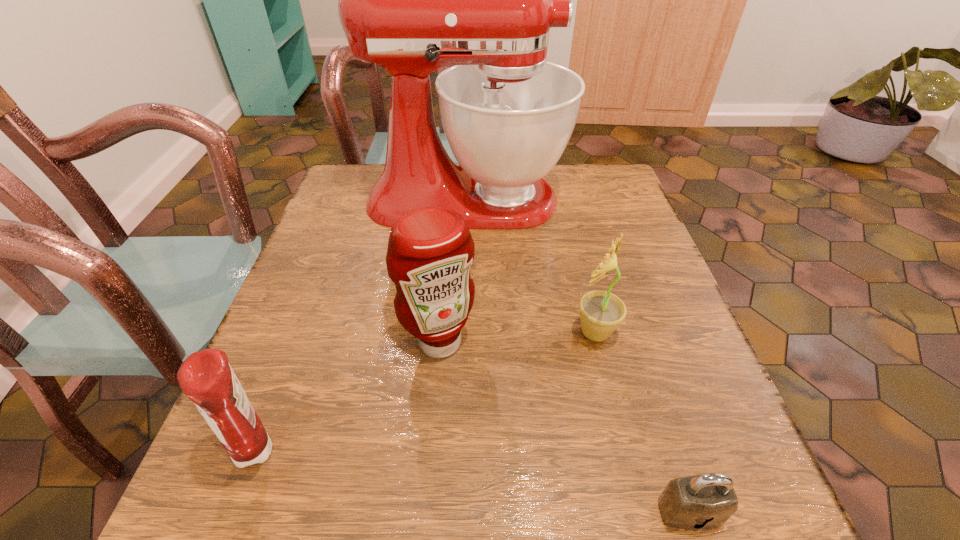
You are a GUI agent. You are given a task and a screenshot of the screen. Output one action in this format:
    pyautogui.click(x=<x>, y=<y>)
    Task: Click on the mixer
    This screenshot has height=540, width=960.
    Given the screenshot: What is the action you would take?
    pyautogui.click(x=412, y=0)

Where is `the tallest object`? the tallest object is located at coordinates (412, 0).

Where is `the right condiment`? Image resolution: width=960 pixels, height=540 pixels. the right condiment is located at coordinates (430, 250).

Where is `the taller condiment`? The image size is (960, 540). the taller condiment is located at coordinates (430, 250).

This screenshot has width=960, height=540. I want to click on sunflower, so click(601, 312).

Find the location of a particular element. The width and height of the screenshot is (960, 540). the shorter condiment is located at coordinates (206, 378).

Where is `the left condiment`? This screenshot has height=540, width=960. the left condiment is located at coordinates (206, 378).

At what (x,y) coordinates should I click in order to perform the action: click on the shortest object. Please return your answer as a coordinate pair (x, y). The width and height of the screenshot is (960, 540). Looking at the image, I should click on (705, 501).

What are the coordinates of `the nearest object` in the screenshot? It's located at (705, 501).

Find the location of `vacant space located 0.050m at the attachment hub of the mixer`. vacant space located 0.050m at the attachment hub of the mixer is located at coordinates (586, 200).